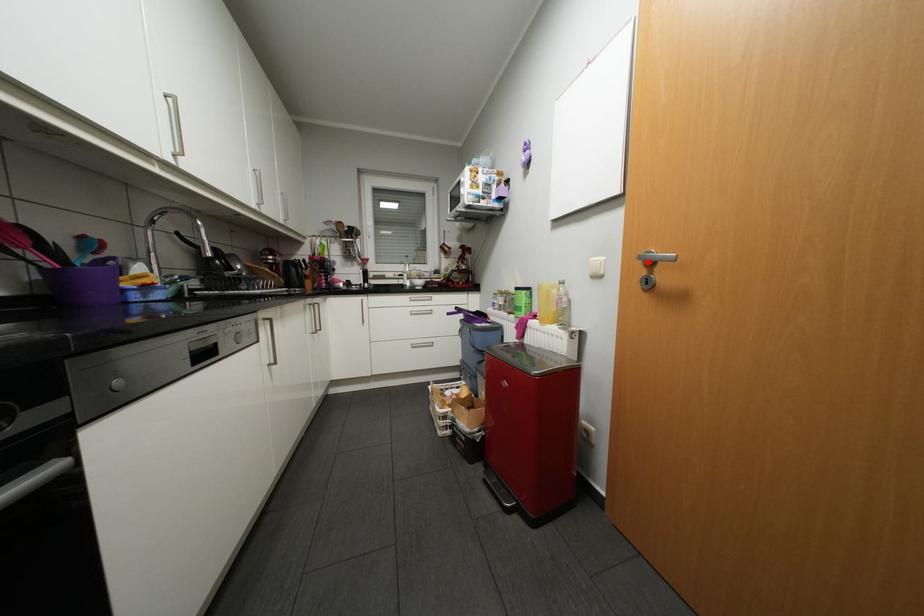
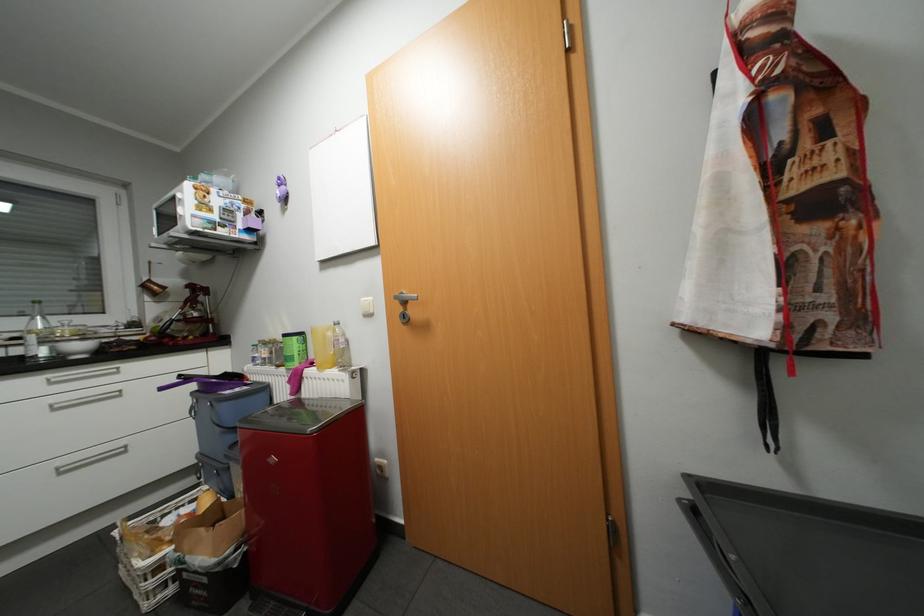
Locate, in the second image, the point that corresponds to the highlighted location in the first image.

(405, 301)